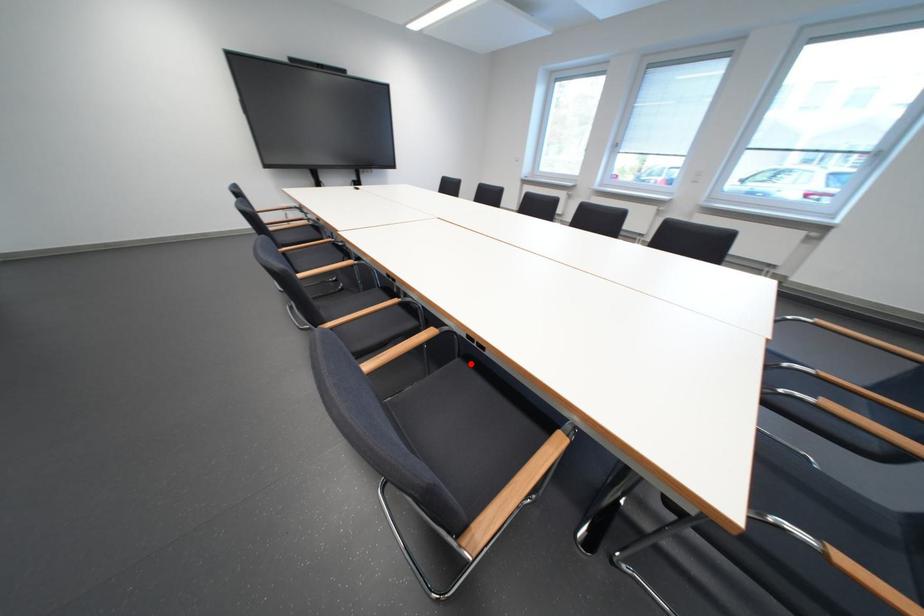
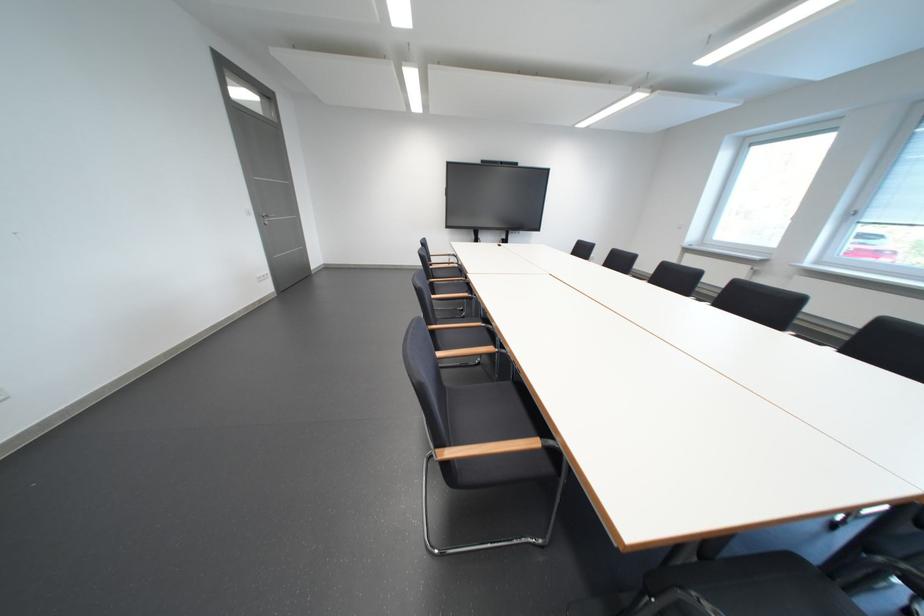
Find the pixel in the second image that matches the highlighted location in the first image.

(523, 386)